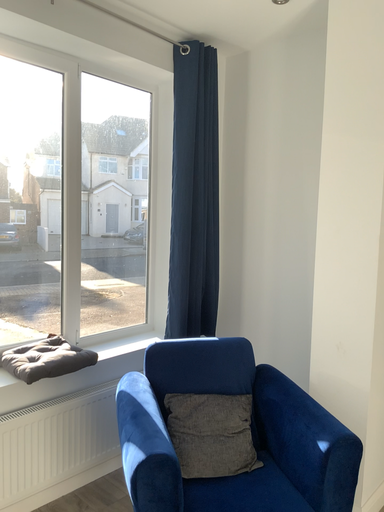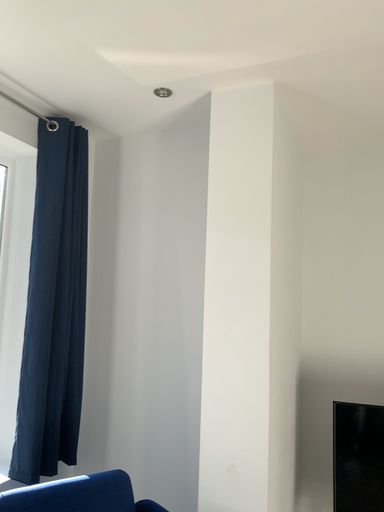
Question: How did the camera likely rotate when shooting the video?

Choices:
 (A) rotated right
 (B) rotated left

Answer: (A)